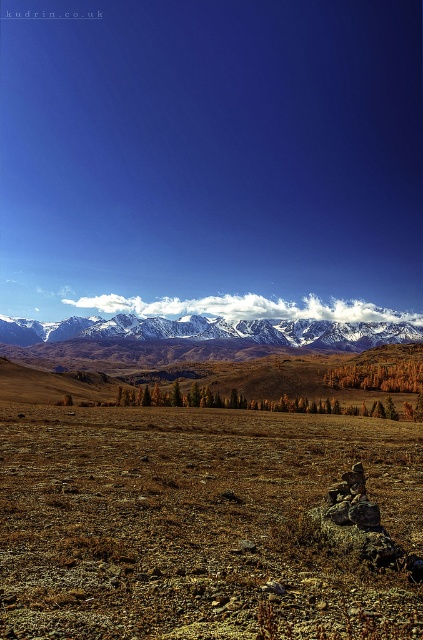
Question: Which point is closer to the camera taking this photo?

Choices:
 (A) (332, 330)
 (B) (335, 376)

Answer: (B)

Question: Does snowy white mountain range at upper center have a greater width compared to yellow-green foliage at center?

Choices:
 (A) yes
 (B) no

Answer: (A)

Question: Is snowy white mountain range at upper center further to camera compared to yellow-green foliage at center?

Choices:
 (A) yes
 (B) no

Answer: (A)

Question: Among these points, which one is farthest from the camera?

Choices:
 (A) (362, 378)
 (B) (43, 336)

Answer: (B)

Question: Which point is closer to the camera?

Choices:
 (A) snowy white mountain range at upper center
 (B) yellow-green foliage at center

Answer: (B)

Question: From the image, what is the correct spatial relationship of snowy white mountain range at upper center in relation to yellow-green foliage at center?

Choices:
 (A) right
 (B) left

Answer: (B)